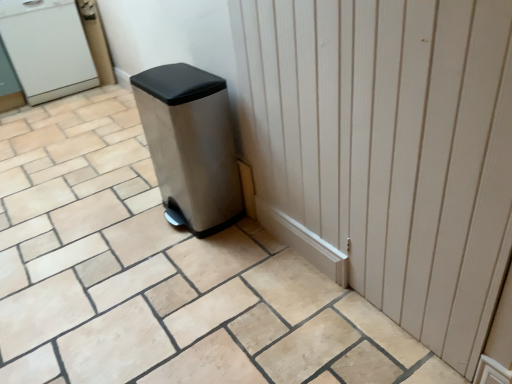
Identify the location of vacant space that is to the left of white wood door at center. (215, 294).